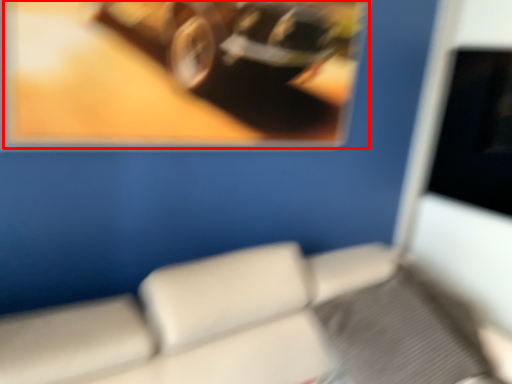
Question: From the image's perspective, where is picture frame (annotated by the red box) located relative to furniture?

Choices:
 (A) below
 (B) above

Answer: (B)